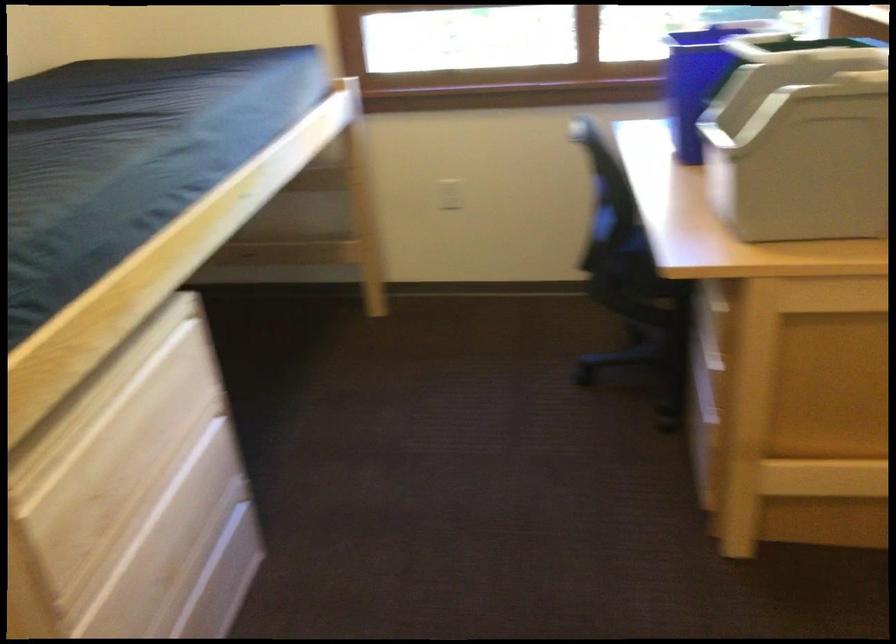
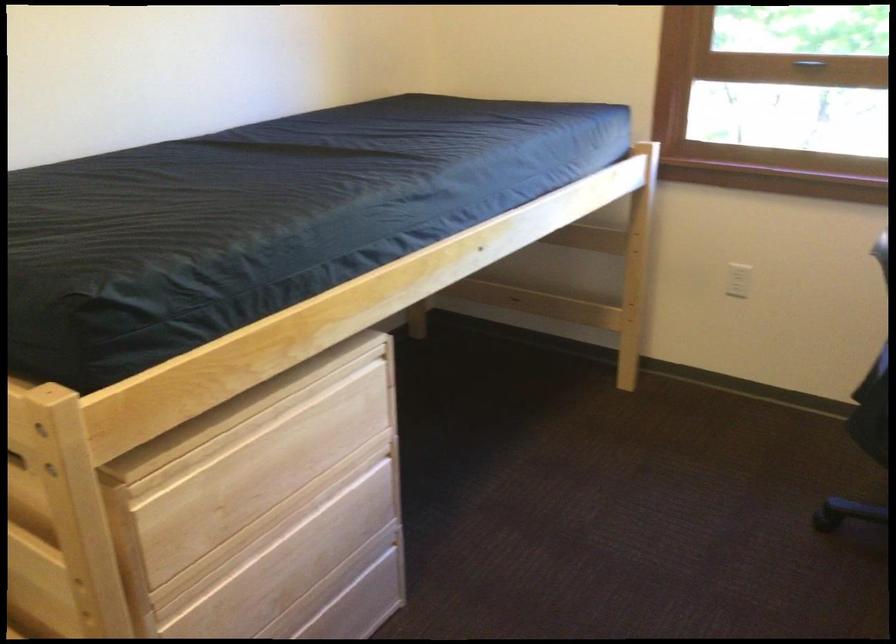
Locate, in the second image, the point that corresponds to (449,194) in the first image.

(738, 279)